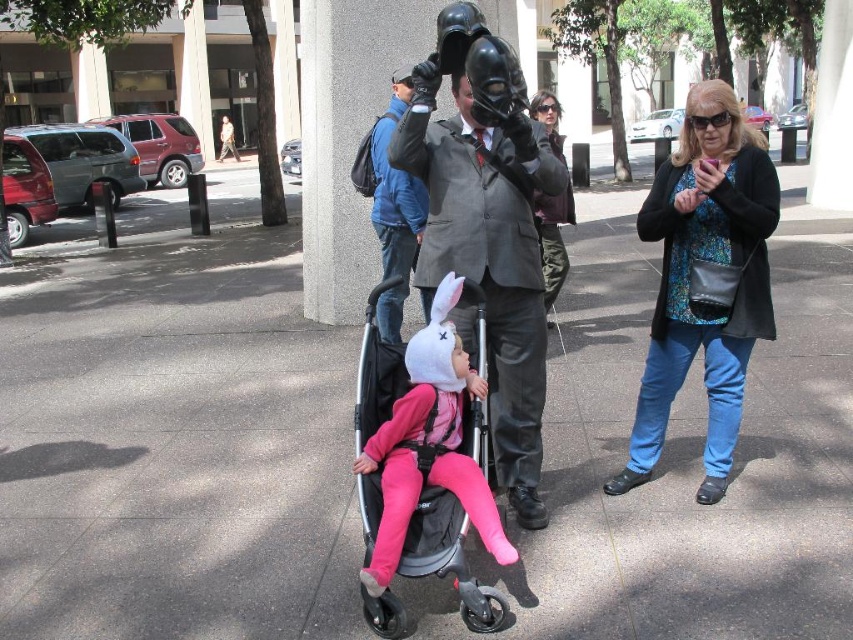
You are a delivery robot that needs to place a package on the gray concrete pavement at center. However, there is a metallic purple jacket at center in the way. Can you move the jacket to make space?

The gray concrete pavement at center is bigger than metallic purple jacket at center, so you can move the metallic purple jacket at center to the side to make space on the gray concrete pavement at center.

You are a photographer trying to capture a photo of both the matte black suit at center and the black matte baby carriage at center in the same frame. Given their sizes, which object should you position closer to the camera to ensure both fit in the frame?

Since the matte black suit at center is wider than the black matte baby carriage at center, you should position the black matte baby carriage at center closer to the camera to ensure both fit in the frame.